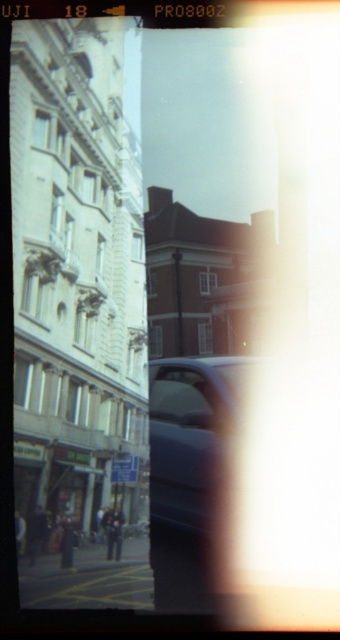
Question: Which of the following is the farthest from the observer?

Choices:
 (A) (173, 397)
 (B) (190, 582)

Answer: (A)

Question: Considering the relative positions of metallic blue car at center and transparent glass car window at center in the image provided, where is metallic blue car at center located with respect to transparent glass car window at center?

Choices:
 (A) left
 (B) right

Answer: (B)

Question: From the image, what is the correct spatial relationship of metallic blue car at center in relation to transparent glass car window at center?

Choices:
 (A) above
 (B) below

Answer: (B)

Question: Considering the relative positions of metallic blue car at center and transparent glass car window at center in the image provided, where is metallic blue car at center located with respect to transparent glass car window at center?

Choices:
 (A) below
 (B) above

Answer: (A)

Question: Which of the following is the closest to the observer?

Choices:
 (A) transparent glass car window at center
 (B) metallic blue car at center

Answer: (B)